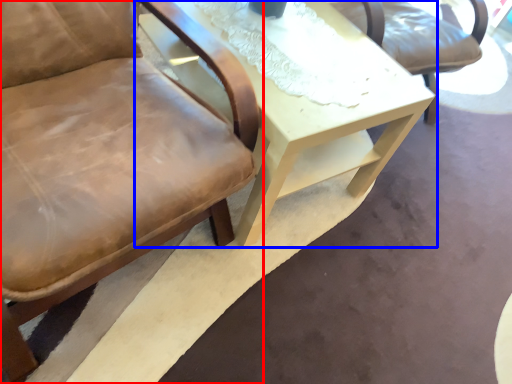
Question: Which point is further to the camera, chair (highlighted by a red box) or table (highlighted by a blue box)?

Choices:
 (A) chair
 (B) table

Answer: (B)